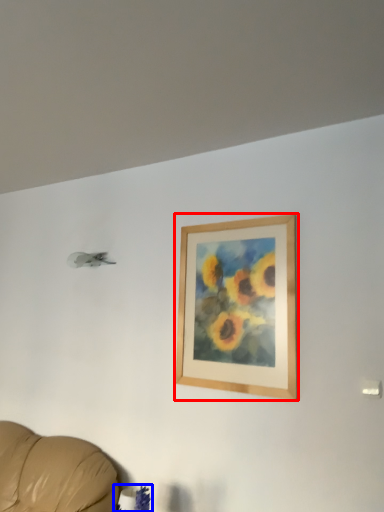
Question: Which object is closer to the camera taking this photo, picture frame (highlighted by a red box) or plant (highlighted by a blue box)?

Choices:
 (A) picture frame
 (B) plant

Answer: (B)